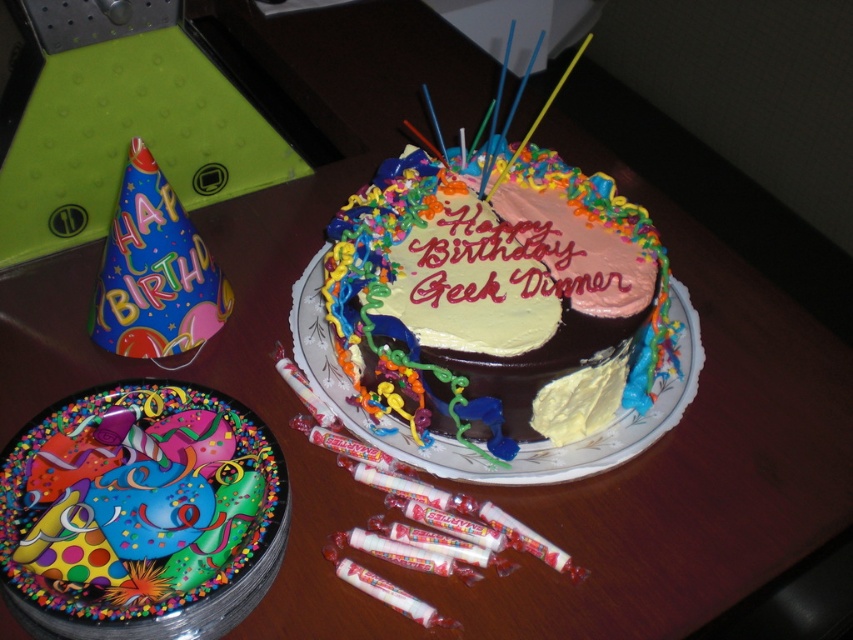
Question: Which point is farther from the camera taking this photo?

Choices:
 (A) (125, 492)
 (B) (544, 435)
 (C) (354, 353)

Answer: (C)

Question: Which of the following is the closest to the observer?

Choices:
 (A) chocolate frosted cake at center
 (B) decorative paper plate at center

Answer: (B)

Question: Can you confirm if decorative paper plate at center is positioned above yellow matte frosting at center?

Choices:
 (A) no
 (B) yes

Answer: (A)

Question: Is chocolate frosted cake at center below decorative paper plate at center?

Choices:
 (A) yes
 (B) no

Answer: (B)

Question: Can you confirm if chocolate frosted cake at center is positioned below yellow matte frosting at center?

Choices:
 (A) yes
 (B) no

Answer: (B)

Question: Which point is closer to the camera?

Choices:
 (A) tap(386, 209)
 (B) tap(91, 512)
 (C) tap(621, 376)

Answer: (B)